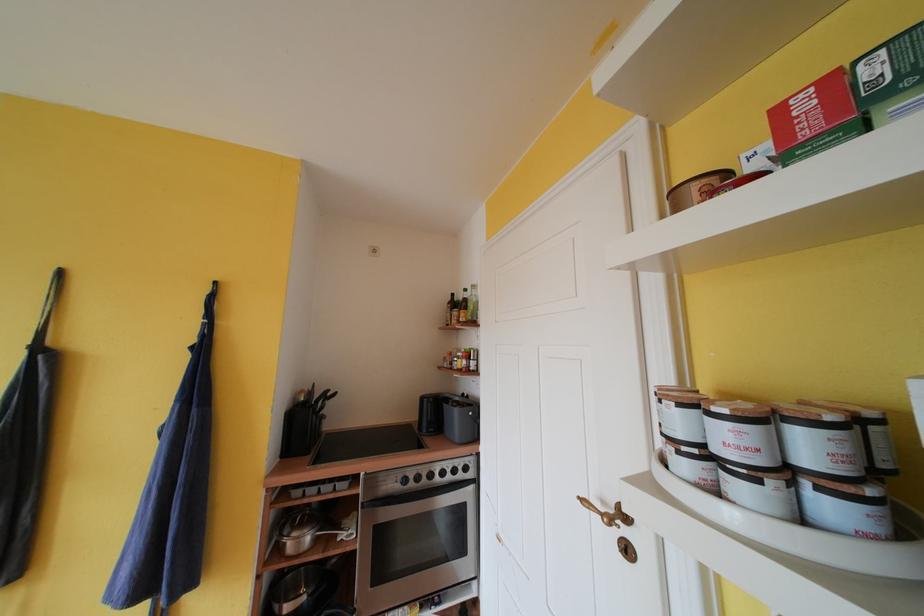
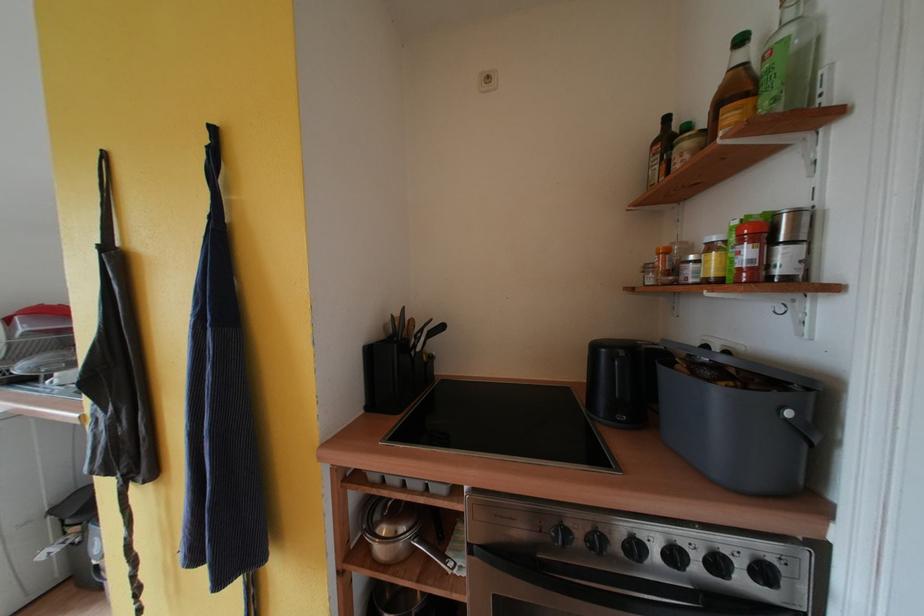
Where in the second image is the point corresponding to (x=369, y=511) from the first image?

(478, 553)